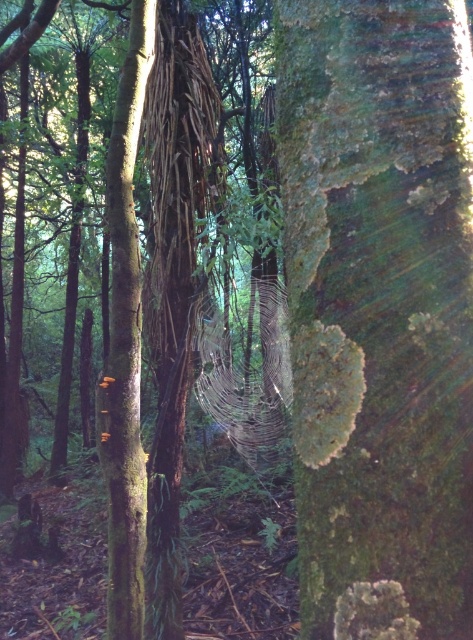
Question: Is green rough bark tree at center wider than smooth brown tree trunk at left?

Choices:
 (A) yes
 (B) no

Answer: (A)

Question: Which object appears closest to the camera in this image?

Choices:
 (A) smooth brown tree trunk at left
 (B) green rough bark tree at center

Answer: (B)

Question: Does green rough bark tree at center have a lesser width compared to smooth brown tree trunk at left?

Choices:
 (A) no
 (B) yes

Answer: (A)

Question: Which object appears closest to the camera in this image?

Choices:
 (A) green rough bark tree at center
 (B) smooth brown tree trunk at left

Answer: (A)

Question: Among these objects, which one is nearest to the camera?

Choices:
 (A) green rough bark tree at center
 (B) smooth brown tree trunk at left

Answer: (A)

Question: Can you confirm if green rough bark tree at center is positioned to the right of smooth brown tree trunk at left?

Choices:
 (A) no
 (B) yes

Answer: (B)